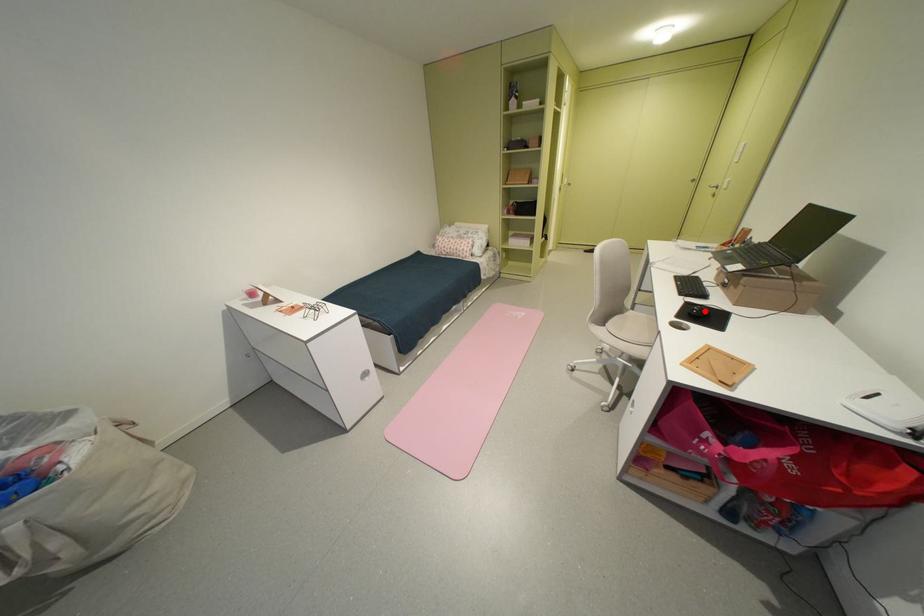
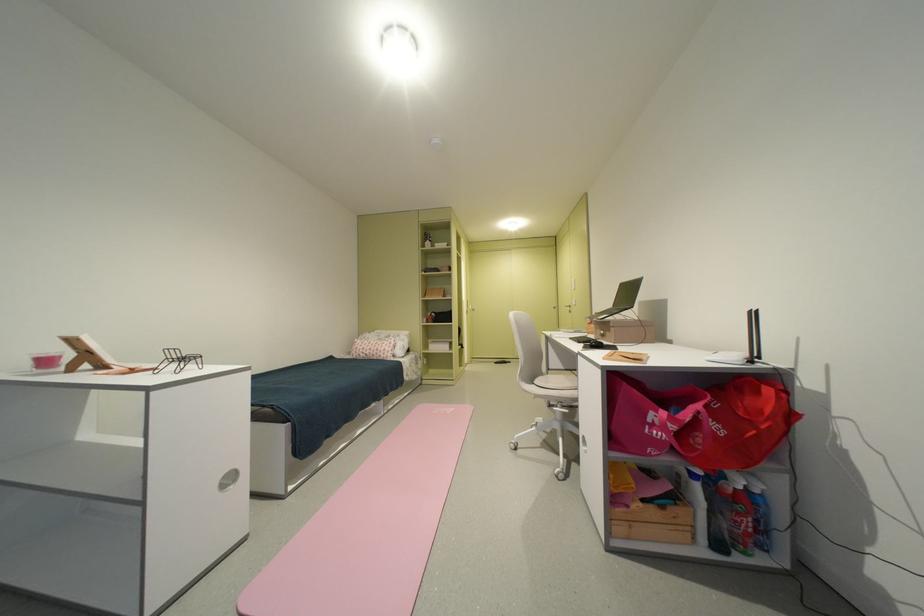
The point at the highlighted location is marked in the first image. Where is the corresponding point in the second image?

(602, 342)